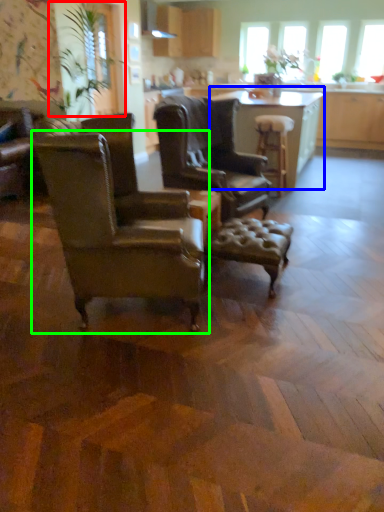
Question: Which is farther away from plant (highlighted by a red box)? table (highlighted by a blue box) or chair (highlighted by a green box)?

Choices:
 (A) table
 (B) chair

Answer: (B)